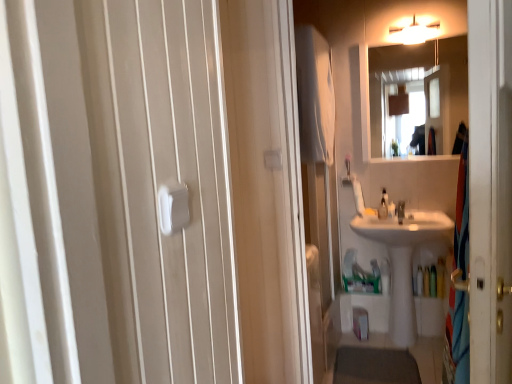
Question: From a real-world perspective, is white soft towel at upper center located higher than translucent plastic bottle at lower right, arranged as the second toiletry when viewed from the left?

Choices:
 (A) yes
 (B) no

Answer: (A)

Question: Can you confirm if white soft towel at upper center is bigger than translucent plastic bottle at lower right, arranged as the second toiletry when viewed from the left?

Choices:
 (A) no
 (B) yes

Answer: (B)

Question: Is white soft towel at upper center not close to translucent plastic bottle at lower right, arranged as the second toiletry when viewed from the left?

Choices:
 (A) yes
 (B) no

Answer: (A)

Question: From a real-world perspective, is white soft towel at upper center beneath translucent plastic bottle at lower right, which is the first toiletry from right to left?

Choices:
 (A) no
 (B) yes

Answer: (A)

Question: Considering the relative positions of white soft towel at upper center and translucent plastic bottle at lower right, arranged as the second toiletry when viewed from the left, in the image provided, is white soft towel at upper center to the right of translucent plastic bottle at lower right, arranged as the second toiletry when viewed from the left, from the viewer's perspective?

Choices:
 (A) no
 (B) yes

Answer: (A)

Question: From the image's perspective, does white soft towel at upper center appear lower than translucent plastic bottle at lower right, arranged as the second toiletry when viewed from the left?

Choices:
 (A) no
 (B) yes

Answer: (A)

Question: Can you confirm if translucent plastic bottle at right, which is counted as the 1th toiletry, starting from the left, is bigger than translucent plastic soap dispenser at center?

Choices:
 (A) yes
 (B) no

Answer: (B)

Question: Is translucent plastic bottle at right, the second toiletry from the right, further to the viewer compared to translucent plastic soap dispenser at center?

Choices:
 (A) yes
 (B) no

Answer: (A)

Question: From the image's perspective, is translucent plastic bottle at right, the second toiletry from the right, on translucent plastic soap dispenser at center?

Choices:
 (A) no
 (B) yes

Answer: (A)

Question: Is translucent plastic bottle at right, which is counted as the 1th toiletry, starting from the left, directly adjacent to translucent plastic soap dispenser at center?

Choices:
 (A) no
 (B) yes

Answer: (A)

Question: From the image's perspective, would you say translucent plastic bottle at right, which is counted as the 1th toiletry, starting from the left, is shown under translucent plastic soap dispenser at center?

Choices:
 (A) no
 (B) yes

Answer: (B)

Question: Considering the relative positions of translucent plastic bottle at right, which is counted as the 1th toiletry, starting from the left, and translucent plastic soap dispenser at center in the image provided, is translucent plastic bottle at right, which is counted as the 1th toiletry, starting from the left, to the right of translucent plastic soap dispenser at center from the viewer's perspective?

Choices:
 (A) yes
 (B) no

Answer: (A)

Question: Does white glossy mirror at upper center appear on the right side of translucent plastic bottle at lower right, which is the first toiletry from right to left?

Choices:
 (A) yes
 (B) no

Answer: (B)